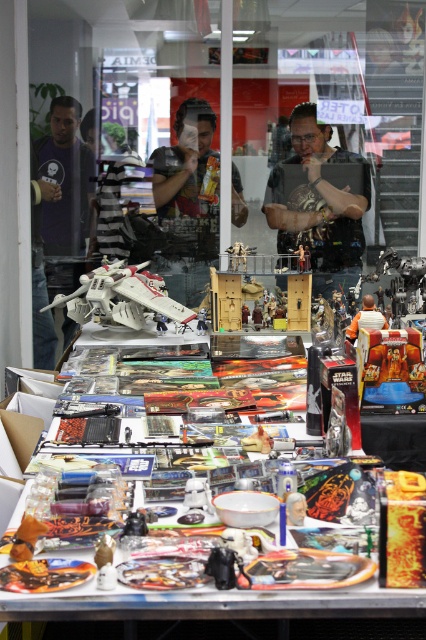
Between point (403, 595) and point (175, 259), which one is positioned behind?

Positioned behind is point (175, 259).

Is metallic silver table at center to the left of matte black figure at center from the viewer's perspective?

Incorrect, metallic silver table at center is not on the left side of matte black figure at center.

Image resolution: width=426 pixels, height=640 pixels. What are the coordinates of `metallic silver table at center` in the screenshot? It's located at (216, 609).

At what (x,y) coordinates should I click in order to perform the action: click on metallic silver table at center. Please return your answer as a coordinate pair (x, y). Image resolution: width=426 pixels, height=640 pixels. Looking at the image, I should click on (216, 609).

Which is more to the left, metallic silver table at center or white plastic toy at center?

From the viewer's perspective, white plastic toy at center appears more on the left side.

Image resolution: width=426 pixels, height=640 pixels. Describe the element at coordinates (216, 609) in the screenshot. I see `metallic silver table at center` at that location.

I want to click on metallic silver table at center, so click(216, 609).

Who is positioned more to the left, metallic silver table at center or matte black t-shirt at center?

From the viewer's perspective, metallic silver table at center appears more on the left side.

You are a GUI agent. You are given a task and a screenshot of the screen. Output one action in this format:
    pyautogui.click(x=<x>, y=<y>)
    Task: Click on the metallic silver table at center
    The height and width of the screenshot is (640, 426).
    Given the screenshot: What is the action you would take?
    pyautogui.click(x=216, y=609)

Does point (150, 616) come behind point (334, 248)?

No.

Locate an element on the screen. Image resolution: width=426 pixels, height=640 pixels. metallic silver table at center is located at coordinates (216, 609).